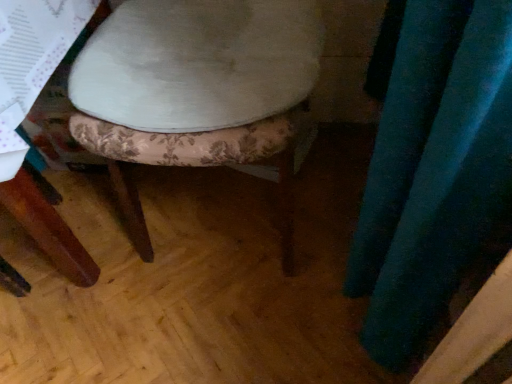
Question: From a real-world perspective, relative to velvet teal curtain at right, is velvet floral-patterned stool at center vertically above or below?

Choices:
 (A) above
 (B) below

Answer: (B)

Question: Considering their positions, is velvet floral-patterned stool at center located in front of or behind velvet teal curtain at right?

Choices:
 (A) front
 (B) behind

Answer: (B)

Question: Which is correct: velvet floral-patterned stool at center is inside velvet teal curtain at right, or outside of it?

Choices:
 (A) outside
 (B) inside

Answer: (A)

Question: From their relative heights in the image, would you say velvet teal curtain at right is taller or shorter than velvet floral-patterned stool at center?

Choices:
 (A) tall
 (B) short

Answer: (B)

Question: Considering the positions of velvet teal curtain at right and velvet floral-patterned stool at center in the image, is velvet teal curtain at right bigger or smaller than velvet floral-patterned stool at center?

Choices:
 (A) big
 (B) small

Answer: (B)

Question: Relative to velvet floral-patterned stool at center, is velvet teal curtain at right in front or behind?

Choices:
 (A) behind
 (B) front

Answer: (B)

Question: Is velvet teal curtain at right wider or thinner than velvet floral-patterned stool at center?

Choices:
 (A) wide
 (B) thin

Answer: (B)